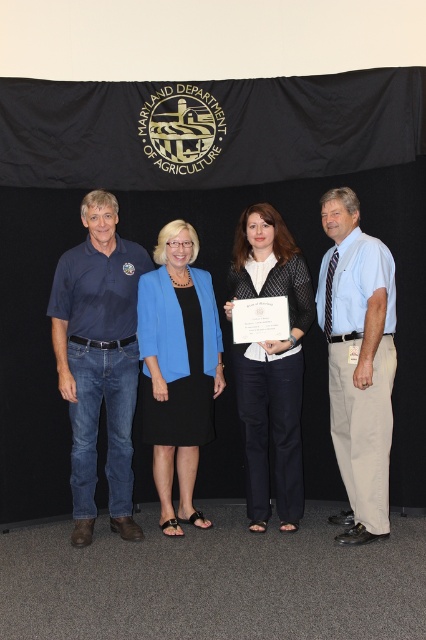
Question: Estimate the real-world distances between objects in this image. Which object is closer to the black textured sweater at center?

Choices:
 (A) blue fabric jacket at center
 (B) matte blue shirt at left
 (C) light blue shirt at center

Answer: (C)

Question: Which is farther from the black textured sweater at center?

Choices:
 (A) matte blue shirt at left
 (B) blue fabric jacket at center

Answer: (A)

Question: Does matte blue shirt at left have a smaller size compared to blue fabric jacket at center?

Choices:
 (A) no
 (B) yes

Answer: (A)

Question: Does matte blue shirt at left have a greater width compared to black textured sweater at center?

Choices:
 (A) yes
 (B) no

Answer: (A)

Question: Does matte blue shirt at left have a larger size compared to blue fabric jacket at center?

Choices:
 (A) no
 (B) yes

Answer: (B)

Question: Based on their relative distances, which object is farther from the light blue shirt at center?

Choices:
 (A) blue fabric jacket at center
 (B) matte blue shirt at left

Answer: (B)